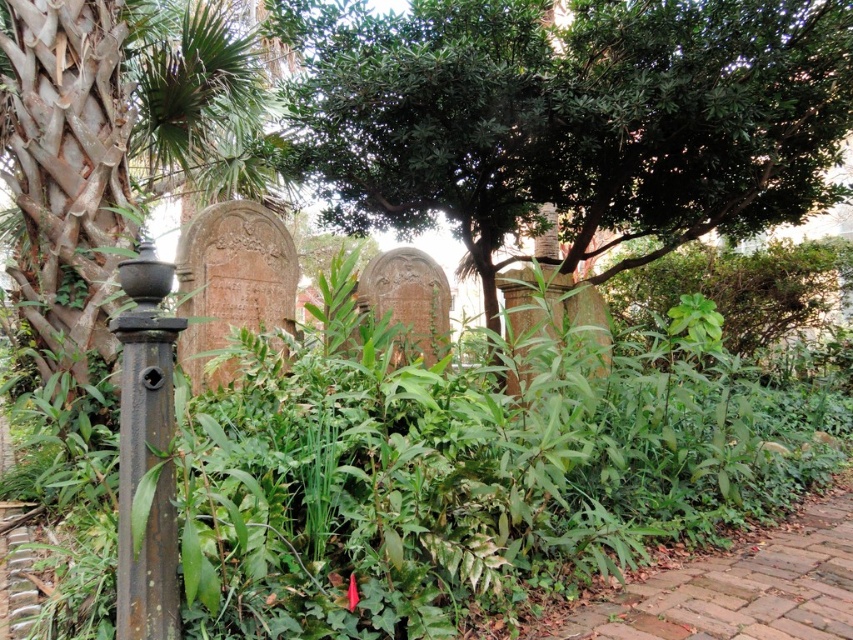
Which is above, brick at lower right or rusty metal pole at left?

Positioned higher is rusty metal pole at left.

Between brick at lower right and rusty metal pole at left, which one appears on the left side from the viewer's perspective?

Positioned to the left is rusty metal pole at left.

What do you see at coordinates (743, 588) in the screenshot?
I see `brick at lower right` at bounding box center [743, 588].

I want to click on brick at lower right, so click(743, 588).

Between point (518, 172) and point (614, 621), which one is positioned in front?

Point (614, 621)

Does point (321, 3) come closer to viewer compared to point (780, 595)?

No, (321, 3) is behind (780, 595).

Which is in front, point (476, 172) or point (735, 582)?

Point (735, 582) is more forward.

Locate an element on the screen. Image resolution: width=853 pixels, height=640 pixels. green leafy tree at center is located at coordinates (570, 116).

Can you confirm if green leafy tree at center is taller than rusty metal pole at left?

Correct, green leafy tree at center is much taller as rusty metal pole at left.

Between point (354, 161) and point (151, 369), which one is positioned behind?

Positioned behind is point (354, 161).

You are a GUI agent. You are given a task and a screenshot of the screen. Output one action in this format:
    pyautogui.click(x=<x>, y=<y>)
    Task: Click on the green leafy tree at center
    The image size is (853, 640).
    Given the screenshot: What is the action you would take?
    pyautogui.click(x=570, y=116)